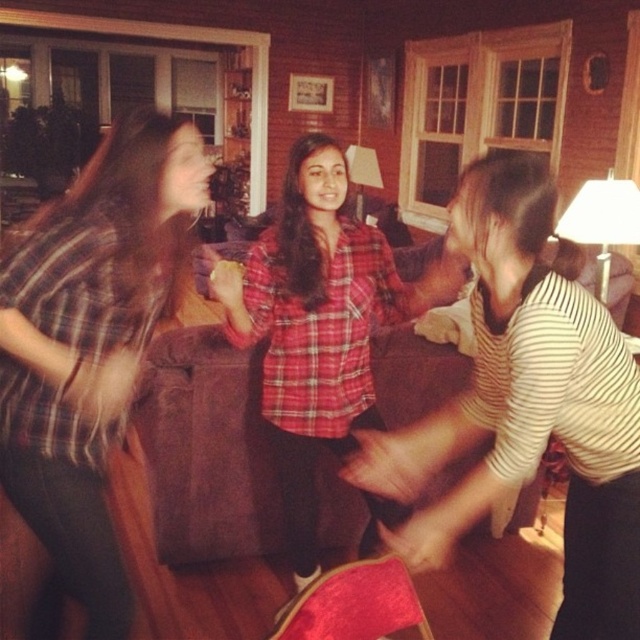
Question: Is striped cotton shirt at center further to camera compared to plaid shirt at center?

Choices:
 (A) yes
 (B) no

Answer: (B)

Question: Where is striped cotton shirt at center located in relation to plaid shirt at center in the image?

Choices:
 (A) left
 (B) right

Answer: (B)

Question: Which of the following is the farthest from the observer?

Choices:
 (A) (621, 396)
 (B) (355, 419)
 (C) (88, 476)

Answer: (B)

Question: Which object appears closest to the camera in this image?

Choices:
 (A) striped cotton shirt at center
 (B) red plaid shirt at center
 (C) plaid shirt at center

Answer: (A)

Question: Which of the following is the farthest from the observer?

Choices:
 (A) 298,568
 (B) 1,273
 (C) 516,346

Answer: (A)

Question: Is plaid shirt at center in front of red plaid shirt at center?

Choices:
 (A) no
 (B) yes

Answer: (B)